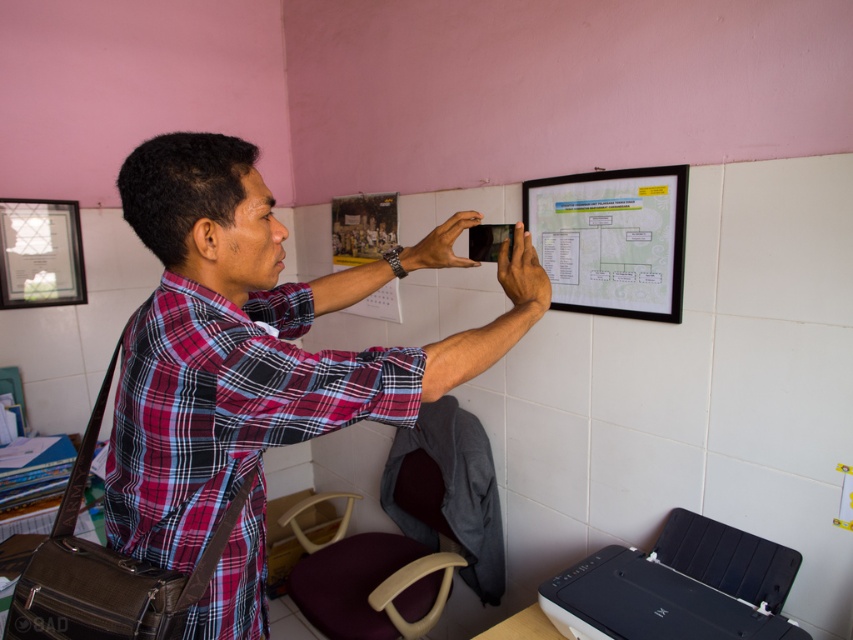
Question: In this image, where is plaid shirt at center located relative to green matte bulletin board at upper center?

Choices:
 (A) above
 (B) below

Answer: (B)

Question: From the image, what is the correct spatial relationship of plaid shirt at center in relation to green matte bulletin board at upper center?

Choices:
 (A) below
 (B) above

Answer: (A)

Question: Which point appears farthest from the camera in this image?

Choices:
 (A) (460, 337)
 (B) (560, 278)

Answer: (B)

Question: Which point is closer to the camera?

Choices:
 (A) (622, 573)
 (B) (242, 467)
 (C) (601, 301)

Answer: (B)

Question: Which point is closer to the camera taking this photo?

Choices:
 (A) (764, 572)
 (B) (624, 182)
 (C) (161, 301)

Answer: (C)

Question: Can you confirm if plaid shirt at center is positioned below green matte bulletin board at upper center?

Choices:
 (A) yes
 (B) no

Answer: (A)